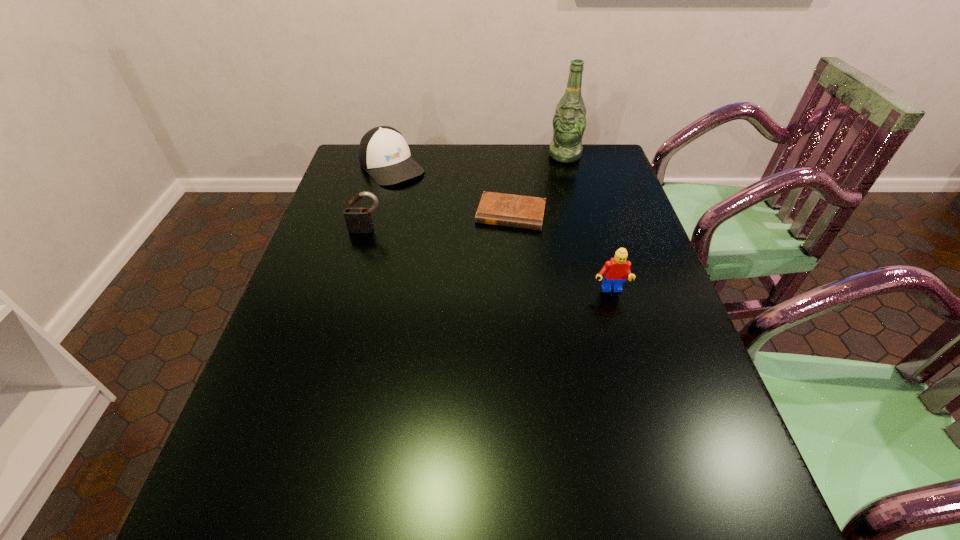
Find the location of `padlock`. padlock is located at coordinates (357, 218).

The width and height of the screenshot is (960, 540). Find the location of `Lego`. Lego is located at coordinates (615, 271).

Where is `the tallest object`? Image resolution: width=960 pixels, height=540 pixels. the tallest object is located at coordinates (569, 122).

Find the location of `cap`. cap is located at coordinates (384, 154).

Locate an element on the screen. This screenshot has width=960, height=540. the shortest object is located at coordinates (510, 210).

You are a GUI agent. You are given a task and a screenshot of the screen. Output one action in this format:
    pyautogui.click(x=<x>, y=<y>)
    Task: Click on the diary
    
    Given the screenshot: What is the action you would take?
    pyautogui.click(x=510, y=210)

Locate an element on the screen. This screenshot has width=960, height=540. vacant space located 0.310m with the keyhole on the front of the padlock is located at coordinates (341, 318).

In order to click on vacant region located 0.230m on the front-facing side of the Lego in this screenshot , I will do `click(635, 380)`.

Where is `free space located on the surface of the beer bottle`? This screenshot has height=540, width=960. free space located on the surface of the beer bottle is located at coordinates click(x=537, y=209).

This screenshot has height=540, width=960. In order to click on vacant position located on the surface of the beer bottle in this screenshot , I will do `click(541, 200)`.